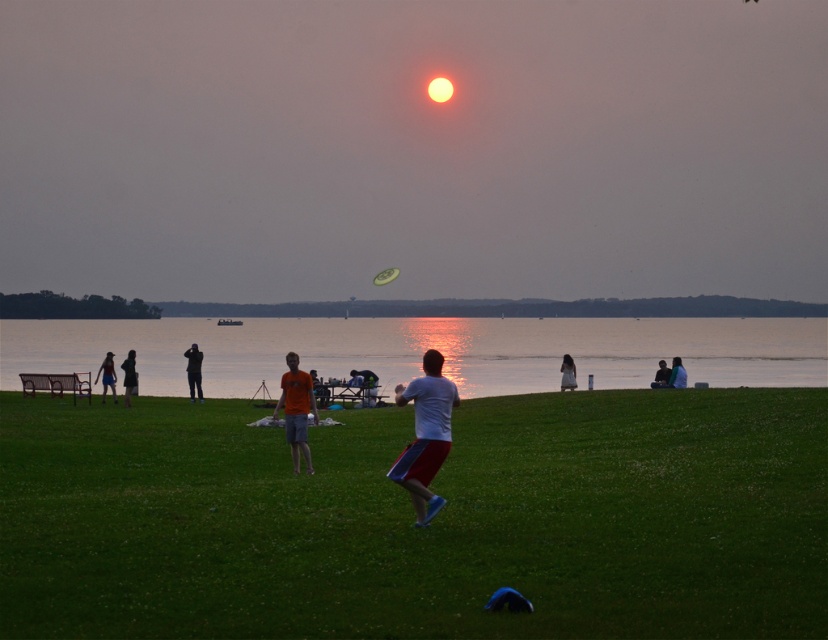
Can you confirm if green grass at center is positioned above smooth skin person at center?

Yes.

Is green grass at center smaller than smooth skin person at center?

Incorrect, green grass at center is not smaller in size than smooth skin person at center.

What do you see at coordinates (412, 518) in the screenshot? I see `green grass at center` at bounding box center [412, 518].

Where is `green grass at center`? This screenshot has height=640, width=828. green grass at center is located at coordinates point(412,518).

From the picture: Which of these two, green grass at center or green matte frisbee at center, stands taller?

green matte frisbee at center

Is green grass at center wider than green matte frisbee at center?

Yes, green grass at center is wider than green matte frisbee at center.

At what (x,y) coordinates should I click in order to perform the action: click on green grass at center. Please return your answer as a coordinate pair (x, y). The width and height of the screenshot is (828, 640). Looking at the image, I should click on (412, 518).

At what (x,y) coordinates should I click in order to perform the action: click on green grass at center. Please return your answer as a coordinate pair (x, y). The width and height of the screenshot is (828, 640). Looking at the image, I should click on (412, 518).

Which is more to the right, reflective silver water at center or orange cotton t-shirt at center?

orange cotton t-shirt at center is more to the right.

Between point (407, 358) and point (301, 401), which one is positioned behind?

Point (407, 358)

The image size is (828, 640). Find the location of `reflective silver water at center`. reflective silver water at center is located at coordinates (424, 349).